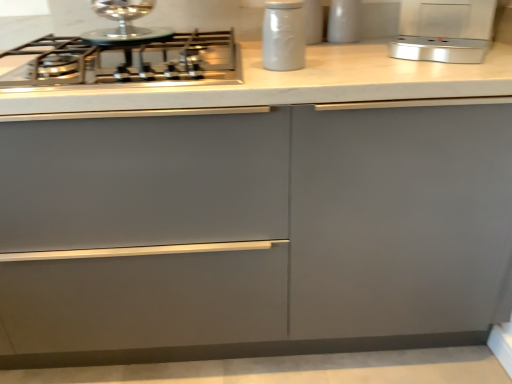
Question: From the image's perspective, is satin steel gas stove at upper left located beneath white matte jar at upper center?

Choices:
 (A) no
 (B) yes

Answer: (B)

Question: Can we say satin steel gas stove at upper left lies outside white matte jar at upper center?

Choices:
 (A) yes
 (B) no

Answer: (A)

Question: Is white matte jar at upper center completely or partially inside satin steel gas stove at upper left?

Choices:
 (A) yes
 (B) no

Answer: (B)

Question: Is satin steel gas stove at upper left to the left of white matte jar at upper center from the viewer's perspective?

Choices:
 (A) yes
 (B) no

Answer: (A)

Question: From the image's perspective, would you say satin steel gas stove at upper left is positioned over white matte jar at upper center?

Choices:
 (A) no
 (B) yes

Answer: (A)

Question: Can you confirm if satin steel gas stove at upper left is bigger than white matte jar at upper center?

Choices:
 (A) no
 (B) yes

Answer: (B)

Question: Does satin steel gas stove at upper left appear on the left side of white glossy jar at upper center, the 2th kitchen appliance from the right?

Choices:
 (A) no
 (B) yes

Answer: (B)

Question: Is the depth of satin steel gas stove at upper left greater than that of white glossy jar at upper center, the 2th kitchen appliance positioned from the left?

Choices:
 (A) no
 (B) yes

Answer: (A)

Question: Is satin steel gas stove at upper left oriented away from white glossy jar at upper center, the 2th kitchen appliance from the right?

Choices:
 (A) no
 (B) yes

Answer: (A)

Question: Is satin steel gas stove at upper left next to white glossy jar at upper center, the 2th kitchen appliance from the right, and touching it?

Choices:
 (A) no
 (B) yes

Answer: (A)

Question: Can we say satin steel gas stove at upper left lies outside white glossy jar at upper center, the 2th kitchen appliance from the right?

Choices:
 (A) no
 (B) yes

Answer: (B)

Question: Is white glossy jar at upper center, the 2th kitchen appliance from the right, surrounded by satin steel gas stove at upper left?

Choices:
 (A) no
 (B) yes

Answer: (A)

Question: Is satin silver toaster at upper right, placed as the 1th kitchen appliance when sorted from right to left, thinner than white matte jar at upper center?

Choices:
 (A) yes
 (B) no

Answer: (B)